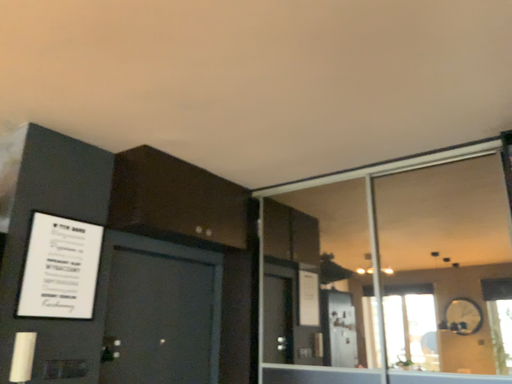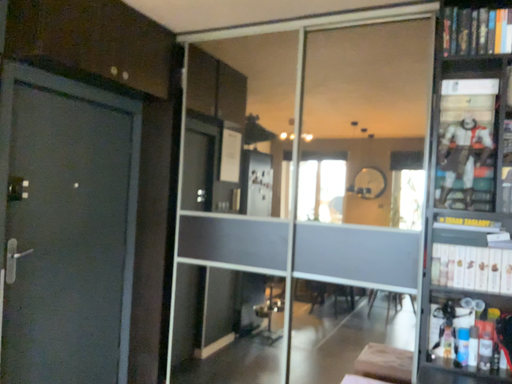
Question: Which way did the camera rotate in the video?

Choices:
 (A) rotated downward
 (B) rotated upward

Answer: (A)